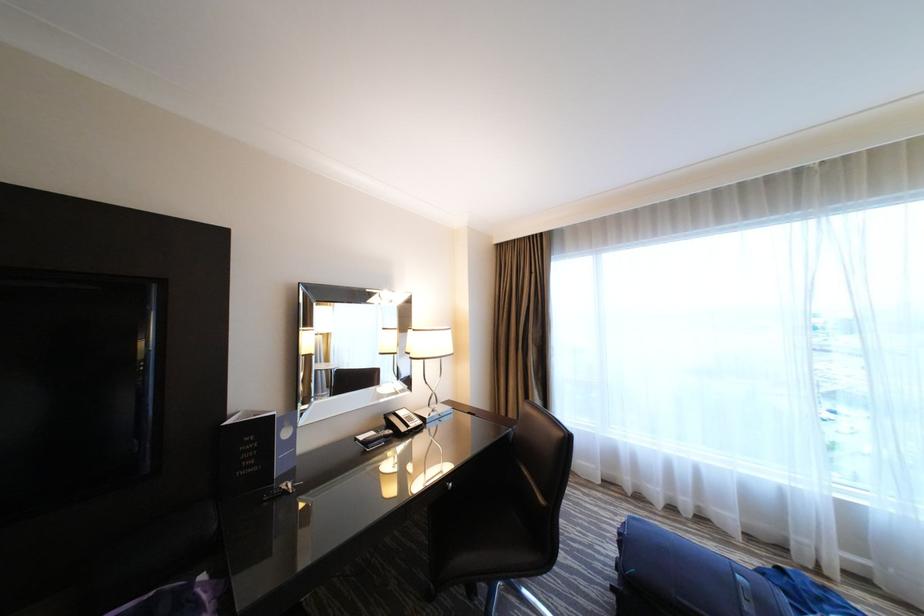
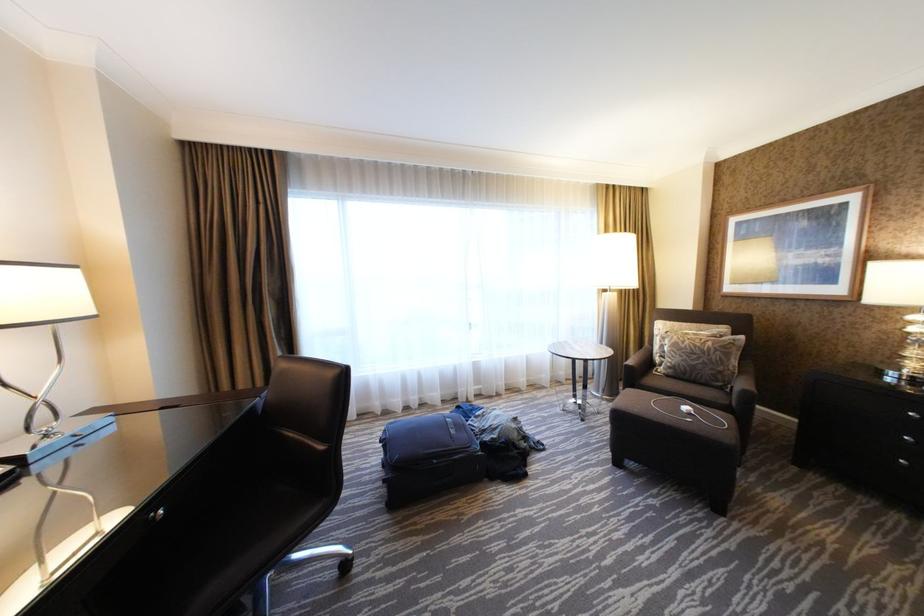
Question: The camera is either moving clockwise (left) or counter-clockwise (right) around the object. The first image is from the beginning of the video and the second image is from the end. Is the camera moving left or right when shooting the video?

Choices:
 (A) Left
 (B) Right

Answer: (A)